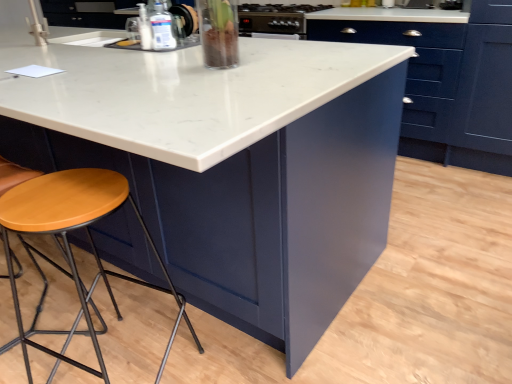
At what (x,y) coordinates should I click in order to perform the action: click on vacant space behind wooden seat stool at lower left. Please return your answer as a coordinate pair (x, y). Image resolution: width=512 pixels, height=384 pixels. Looking at the image, I should click on (145, 311).